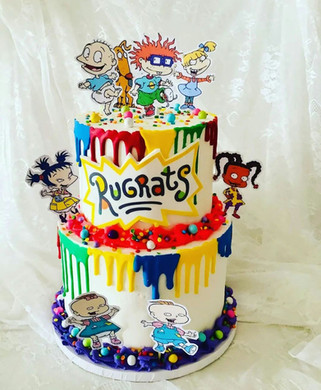
At what (x,y) coordinates should I click in order to perform the action: click on the front of cake plate. Please return your answer as a coordinate pair (x, y). This screenshot has width=321, height=390. Looking at the image, I should click on (132, 377), (122, 379).